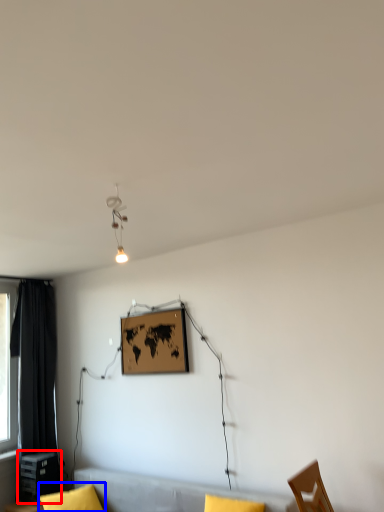
Question: Which object appears farthest to the camera in this image, table (highlighted by a red box) or pillow (highlighted by a blue box)?

Choices:
 (A) table
 (B) pillow

Answer: (A)